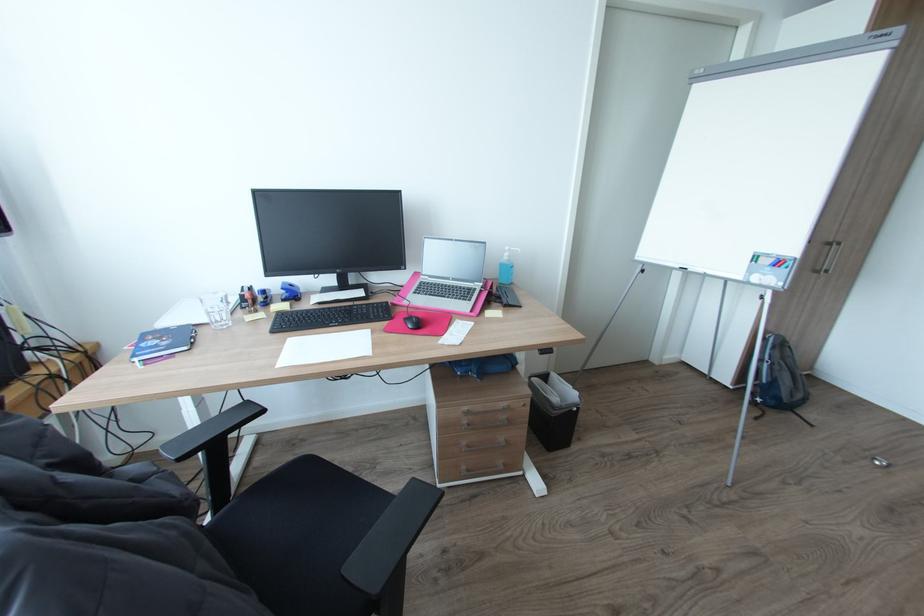
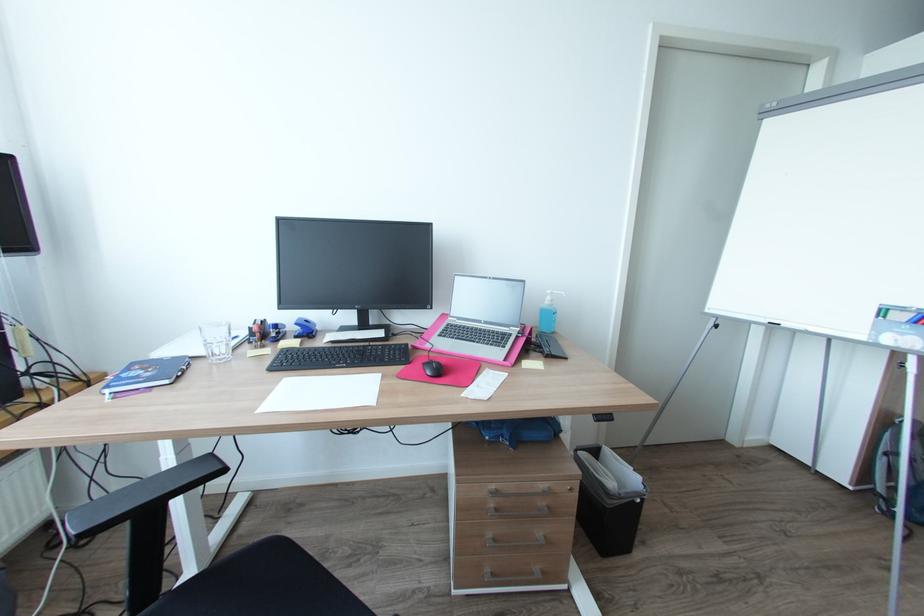
Question: How did the camera likely rotate?

Choices:
 (A) Left
 (B) Right
 (C) Up
 (D) Down

Answer: (C)